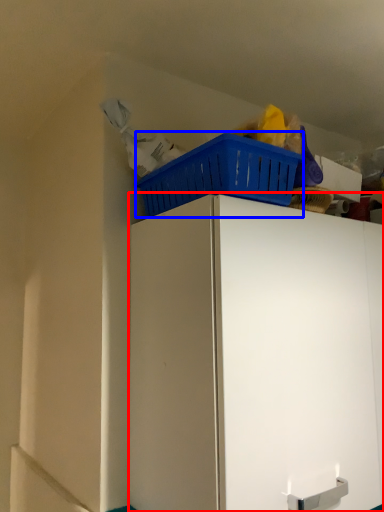
Question: Which point is closer to the camera, cabinetry (highlighted by a red box) or basket (highlighted by a blue box)?

Choices:
 (A) cabinetry
 (B) basket

Answer: (A)